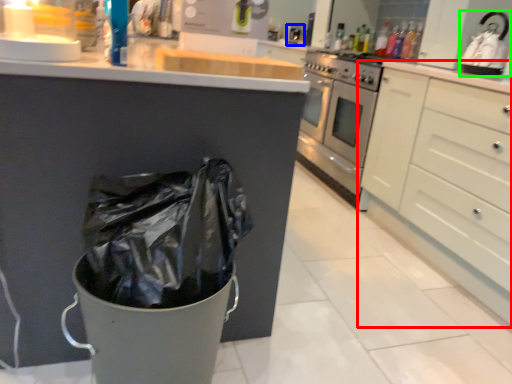
Question: Considering the real-world distances, which object is farthest from cabinetry (highlighted by a red box)? sink (highlighted by a blue box) or appliance (highlighted by a green box)?

Choices:
 (A) sink
 (B) appliance

Answer: (A)